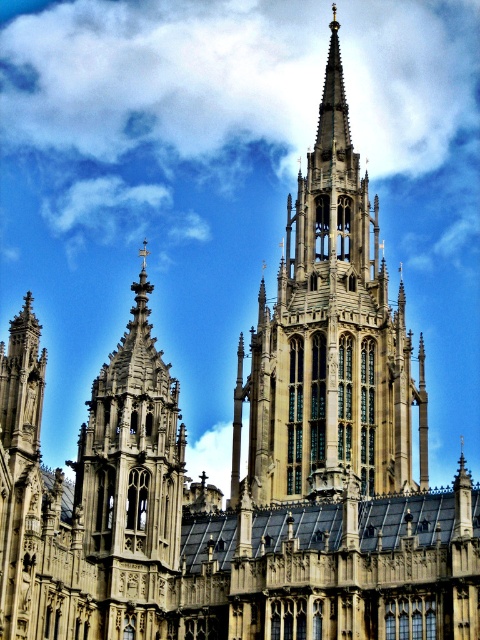
You are standing in front of the grand Gothic building and looking up at the sky. You notice the white fluffy cloud at upper center and the golden stone spire at center. Which object is positioned more to the left side of your view?

The white fluffy cloud at upper center is positioned to the left of the golden stone spire at center, so it is more to the left side of your view.

You are an architect evaluating the cathedral design. You notice the white fluffy cloud at upper center and the golden stone spire at center. Which structure is taller?

The golden stone spire at center is taller than the white fluffy cloud at upper center.